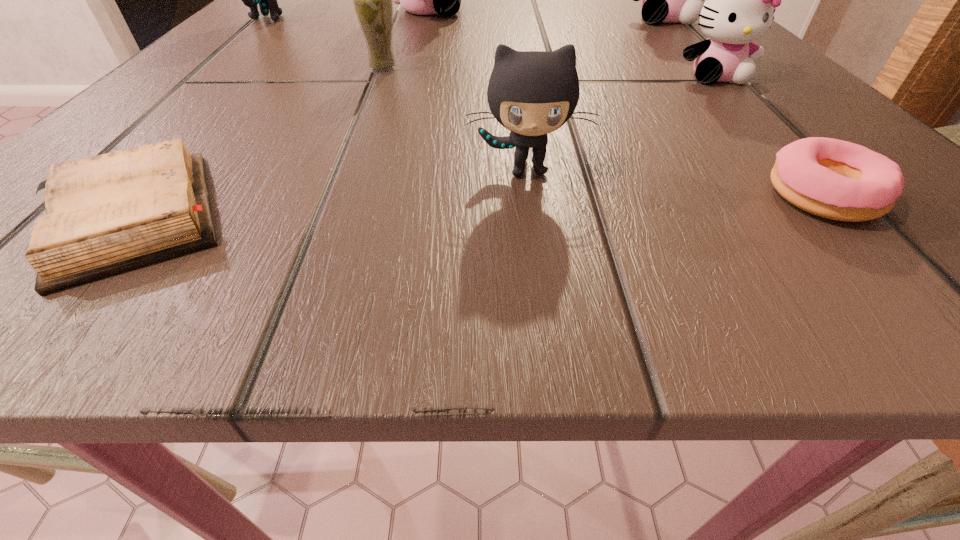
The height and width of the screenshot is (540, 960). I want to click on object situated at the far right corner, so pyautogui.click(x=665, y=0).

Image resolution: width=960 pixels, height=540 pixels. In order to click on object that is at the near right corner in this screenshot , I will do `click(834, 179)`.

Identify the location of blank space at the far edge. (459, 31).

Find the location of a particular element. Image resolution: width=960 pixels, height=540 pixels. blank area at the left edge is located at coordinates (224, 74).

This screenshot has height=540, width=960. Identify the location of vacant space at the right edge of the desktop. (828, 114).

Where is `free space at the far left corner of the desktop`? The image size is (960, 540). free space at the far left corner of the desktop is located at coordinates (287, 10).

Locate an element on the screen. The width and height of the screenshot is (960, 540). vacant region at the far right corner is located at coordinates (698, 26).

Locate an element on the screen. blank region between the doughnut and the yellow straw for drinking is located at coordinates (603, 133).

Where is `free space between the yellow straw for drinking and the right gray kitten`? This screenshot has height=540, width=960. free space between the yellow straw for drinking and the right gray kitten is located at coordinates (455, 119).

This screenshot has width=960, height=540. Identify the location of unoccupied position between the pink doughnut and the nearest kitten. (675, 183).